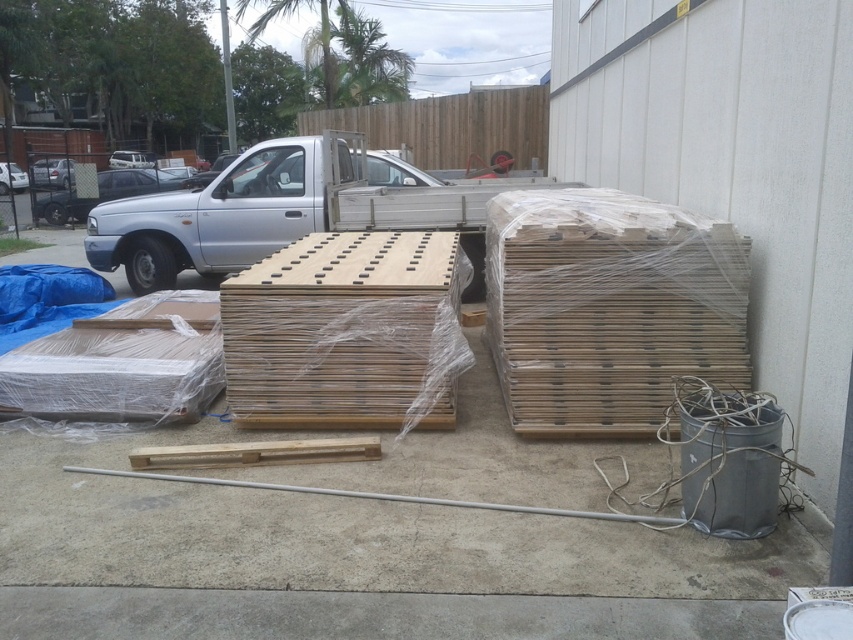
Question: Can you confirm if wooden crates at right is positioned above natural wood crate at center?

Choices:
 (A) no
 (B) yes

Answer: (B)

Question: Is wooden crates at right in front of natural wood crate at center?

Choices:
 (A) no
 (B) yes

Answer: (B)

Question: Can you confirm if wooden crates at right is thinner than natural wood crate at center?

Choices:
 (A) yes
 (B) no

Answer: (A)

Question: Which point is closer to the camera?

Choices:
 (A) wooden crates at right
 (B) natural wood crate at center

Answer: (A)

Question: Which point is closer to the camera?

Choices:
 (A) (x=735, y=282)
 (B) (x=445, y=321)

Answer: (A)